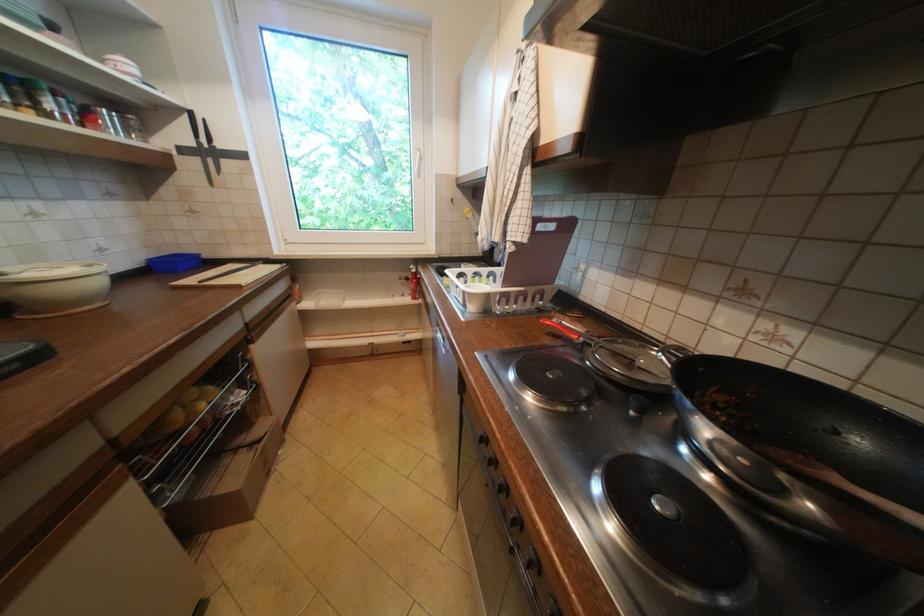
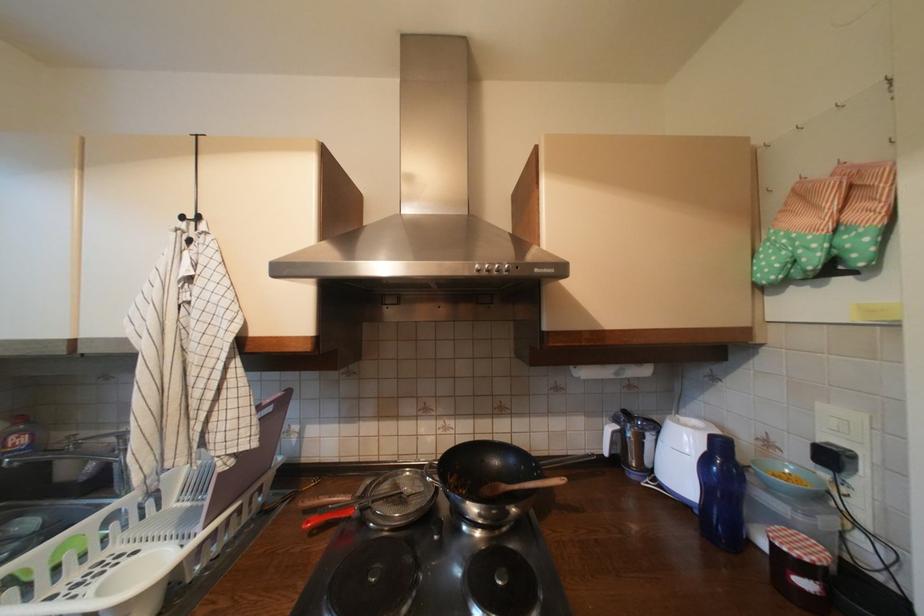
Locate, in the second image, the point that corresponds to (x=527, y=52) in the first image.

(187, 230)